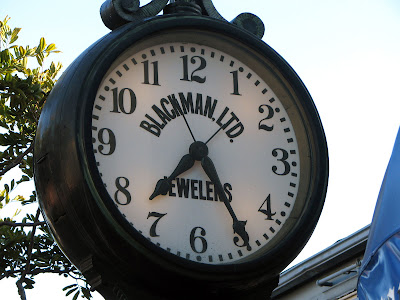
Identify the location of clock frame. The width and height of the screenshot is (400, 300). (84, 206).